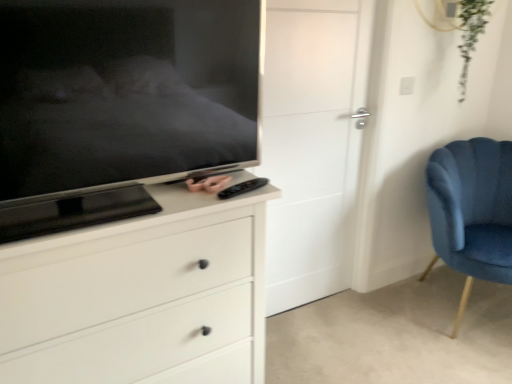
What is the approximate height of matte black tv at left?

20.19 inches.

Image resolution: width=512 pixels, height=384 pixels. What do you see at coordinates (242, 188) in the screenshot?
I see `black plastic remote at center` at bounding box center [242, 188].

Describe the element at coordinates (208, 184) in the screenshot. I see `pink matte remote control at center` at that location.

What is the approximate width of pink matte remote control at center?

4.10 inches.

Identify the location of matte black tv at left. (119, 105).

From a real-world perspective, which is physically above, black plastic remote at center or white matte door at center?

black plastic remote at center is physically above.

Considering the positions of points (225, 193) and (303, 62), is point (225, 193) closer to camera compared to point (303, 62)?

Yes, point (225, 193) is closer to viewer.

Identify the location of remote above the white matte door at center (from a real-world perspective). (242, 188).

Considering the relative sizes of pink matte remote control at center and white matte door at center in the image provided, is pink matte remote control at center thinner than white matte door at center?

No.

Is pink matte remote control at center looking in the opposite direction of white matte door at center?

No, pink matte remote control at center is not facing the opposite direction of white matte door at center.

Identify the location of hand below the white matte door at center (from the image's perspective). The width and height of the screenshot is (512, 384). (208, 184).

Measure the distance from pink matte remote control at center to white matte door at center.

95.82 centimeters.

From the image's perspective, does white matte chest of drawers at center appear lower than velvet blue chair at right?

Indeed, from the image's perspective, white matte chest of drawers at center is shown beneath velvet blue chair at right.

Can you tell me how much white matte chest of drawers at center and velvet blue chair at right differ in facing direction?

23.3 degrees.

Which object is wider, white matte chest of drawers at center or velvet blue chair at right?

With larger width is velvet blue chair at right.

Considering the positions of point (174, 8) and point (510, 181), is point (174, 8) closer or farther from the camera than point (510, 181)?

Point (174, 8) appears to be closer to the viewer than point (510, 181).

Where is `chair behind the matte black tv at left`? chair behind the matte black tv at left is located at coordinates (472, 211).

Is matte black tv at left situated inside velvet blue chair at right or outside?

matte black tv at left is outside velvet blue chair at right.

Considering their positions, is matte black tv at left located in front of or behind velvet blue chair at right?

Clearly, matte black tv at left is in front of velvet blue chair at right.

Is black plastic remote at center next to pink matte remote control at center?

Yes, black plastic remote at center is right next to pink matte remote control at center and making contact.

How different are the orientations of black plastic remote at center and pink matte remote control at center in degrees?

They differ by 2.84 degrees in their facing directions.

Looking at this image, from the image's perspective, is black plastic remote at center located above or below pink matte remote control at center?

From the image's perspective, black plastic remote at center appears below pink matte remote control at center.

Identify the location of hand above the black plastic remote at center (from the image's perspective). tap(208, 184).

Is pink matte remote control at center touching black plastic remote at center?

Yes, pink matte remote control at center is beside black plastic remote at center.

From the picture: Does pink matte remote control at center have a greater height compared to black plastic remote at center?

Yes.

How different are the orientations of pink matte remote control at center and black plastic remote at center in degrees?

The facing directions of pink matte remote control at center and black plastic remote at center are 2.84 degrees apart.

Measure the distance between white matte chest of drawers at center and pink matte remote control at center.

13.77 inches.

Based on the photo, is white matte chest of drawers at center outside of pink matte remote control at center?

Indeed, white matte chest of drawers at center is completely outside pink matte remote control at center.

Does white matte chest of drawers at center appear on the left side of pink matte remote control at center?

Indeed, white matte chest of drawers at center is positioned on the left side of pink matte remote control at center.

In terms of height, does white matte chest of drawers at center look taller or shorter compared to pink matte remote control at center?

Clearly, white matte chest of drawers at center is taller compared to pink matte remote control at center.

Find the location of a particular element. The height and width of the screenshot is (384, 512). door below the black plastic remote at center (from a real-world perspective) is located at coordinates (312, 143).

You are a GUI agent. You are given a task and a screenshot of the screen. Output one action in this format:
    pyautogui.click(x=<x>, y=<y>)
    Task: Click on the hand that appears above the white matte door at center (from a real-world perspective)
    The width and height of the screenshot is (512, 384).
    Given the screenshot: What is the action you would take?
    pyautogui.click(x=208, y=184)

Looking at the image, which one is located further to black plastic remote at center, velvet blue chair at right or white matte door at center?

velvet blue chair at right is further to black plastic remote at center.

From the image, which object appears to be nearer to white matte door at center, white matte chest of drawers at center or matte black tv at left?

matte black tv at left.

Looking at the image, which one is located closer to black plastic remote at center, pink matte remote control at center or matte black tv at left?

Among the two, pink matte remote control at center is located nearer to black plastic remote at center.

Considering their positions, is matte black tv at left positioned closer to white matte chest of drawers at center than pink matte remote control at center?

matte black tv at left lies closer to white matte chest of drawers at center than the other object.

Which object lies nearer to the anchor point black plastic remote at center, pink matte remote control at center or white matte chest of drawers at center?

pink matte remote control at center lies closer to black plastic remote at center than the other object.

In the scene shown: Estimate the real-world distances between objects in this image. Which object is closer to matte black tv at left, pink matte remote control at center or white matte chest of drawers at center?

white matte chest of drawers at center lies closer to matte black tv at left than the other object.

In the scene shown: Which object lies nearer to the anchor point white matte door at center, black plastic remote at center or pink matte remote control at center?

black plastic remote at center is positioned closer to the anchor white matte door at center.

Which object lies further to the anchor point white matte chest of drawers at center, black plastic remote at center or white matte door at center?

Based on the image, white matte door at center appears to be further to white matte chest of drawers at center.

Locate an element on the screen. remote between pink matte remote control at center and white matte chest of drawers at center from top to bottom is located at coordinates (242, 188).

The image size is (512, 384). Identify the location of hand situated between white matte chest of drawers at center and velvet blue chair at right from left to right. (208, 184).

Locate an element on the screen. hand positioned between black plastic remote at center and white matte door at center from near to far is located at coordinates (208, 184).

Where is `remote between pink matte remote control at center and velvet blue chair at right in the horizontal direction`? remote between pink matte remote control at center and velvet blue chair at right in the horizontal direction is located at coordinates (242, 188).